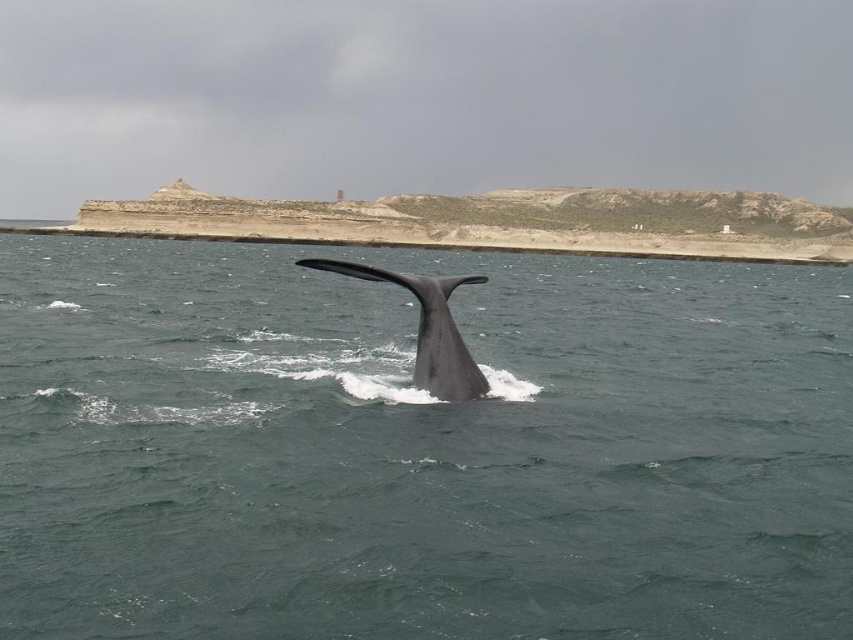
Measure the distance between dark blue water at center and gray matte whale tail at center.

dark blue water at center is 35.43 meters away from gray matte whale tail at center.

This screenshot has width=853, height=640. Describe the element at coordinates (419, 449) in the screenshot. I see `dark blue water at center` at that location.

Find the location of a particular element. The width and height of the screenshot is (853, 640). dark blue water at center is located at coordinates (419, 449).

Between dark blue water at center and rugged stone coast at center, which one is positioned lower?

Positioned lower is dark blue water at center.

Who is more distant from viewer, (193, 396) or (769, 202)?

Point (769, 202)

The image size is (853, 640). In order to click on dark blue water at center in this screenshot , I will do `click(419, 449)`.

Does point (552, 241) come in front of point (318, 266)?

That is False.

Is rugged stone coast at center to the right of gray matte whale tail at center from the viewer's perspective?

Yes, rugged stone coast at center is to the right of gray matte whale tail at center.

Describe the element at coordinates (503, 221) in the screenshot. I see `rugged stone coast at center` at that location.

This screenshot has width=853, height=640. I want to click on rugged stone coast at center, so click(x=503, y=221).